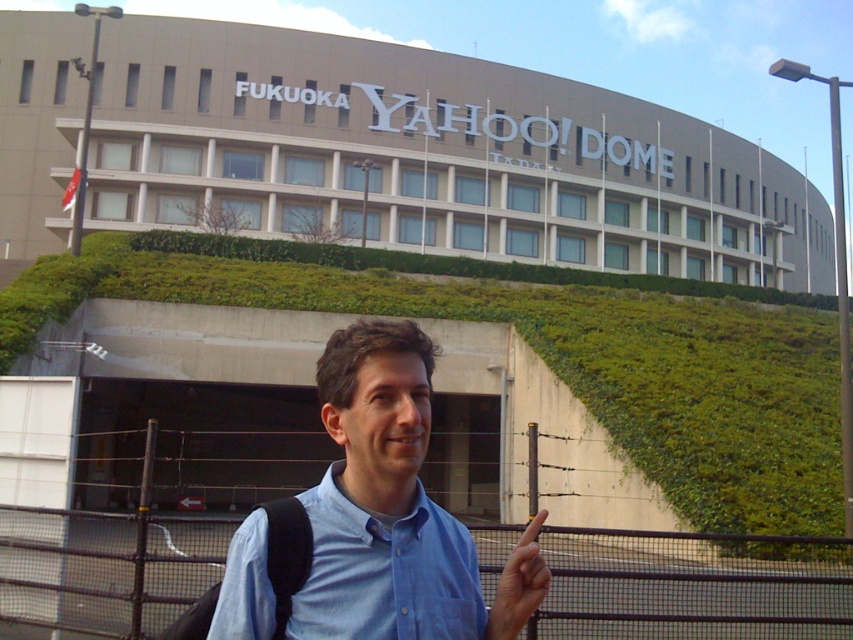
You are a visitor at the FUKUOKA YAHOO! DOME and see both the blue cotton shirt at center and the blue cotton shirt at lower center. Which one is closer to the ground?

The blue cotton shirt at lower center is closer to the ground because it is positioned above the blue cotton shirt at center.

You are a photographer trying to capture a clear shot of the person pointing at the building. The blue cotton shirt at lower center and the skinny finger at center are in your frame. Which object should you focus on to ensure the person is in sharp focus?

You should focus on the blue cotton shirt at lower center because it is positioned over the skinny finger at center, meaning it is closer to the camera and would be in focus if the finger is out of focus.